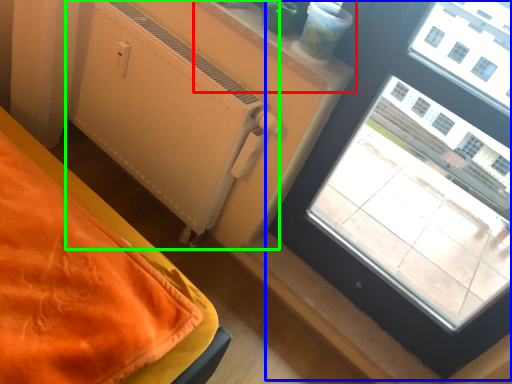
Question: Which is farther away from window sill (highlighted by a red box)? window (highlighted by a blue box) or radiator (highlighted by a green box)?

Choices:
 (A) window
 (B) radiator

Answer: (A)